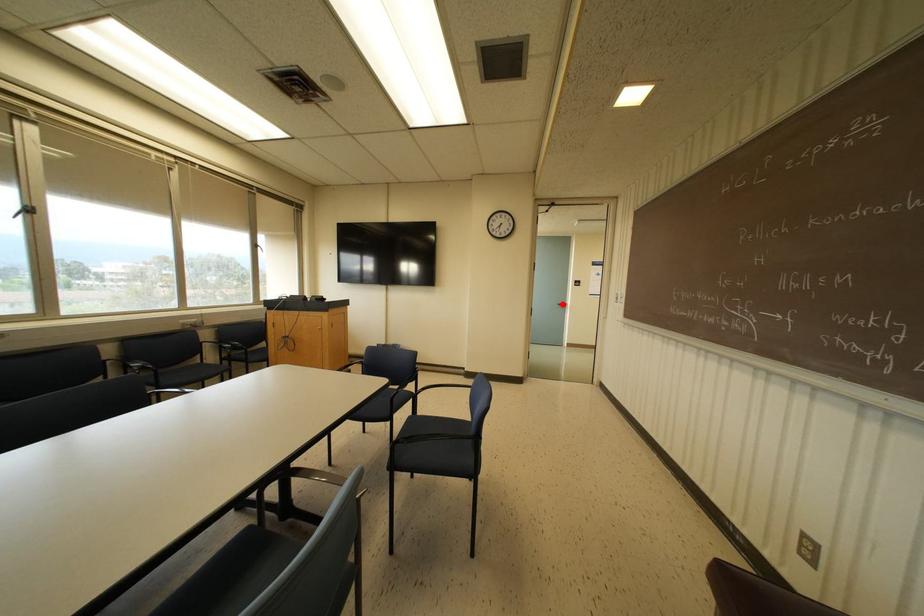
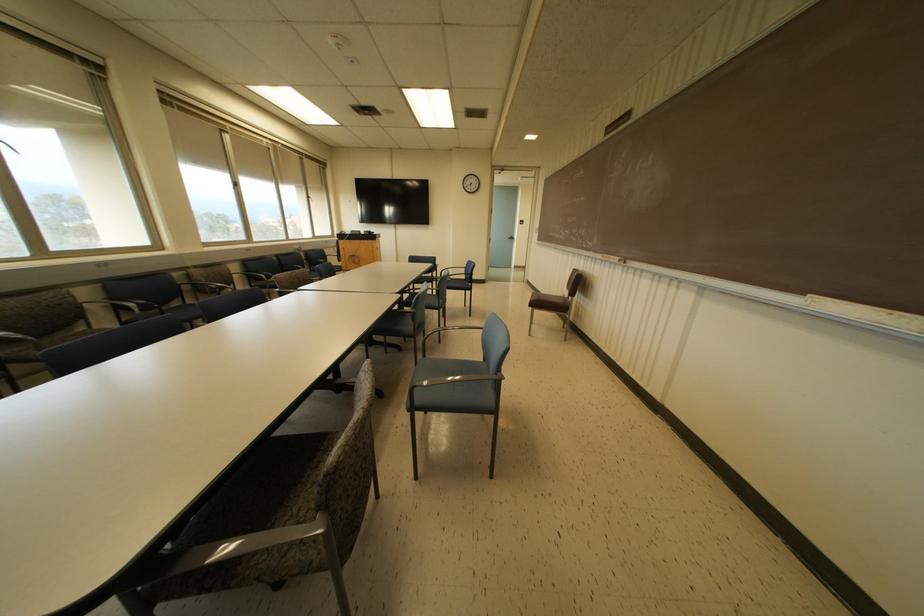
The point at the highlighted location is marked in the first image. Where is the corresponding point in the second image?

(512, 238)